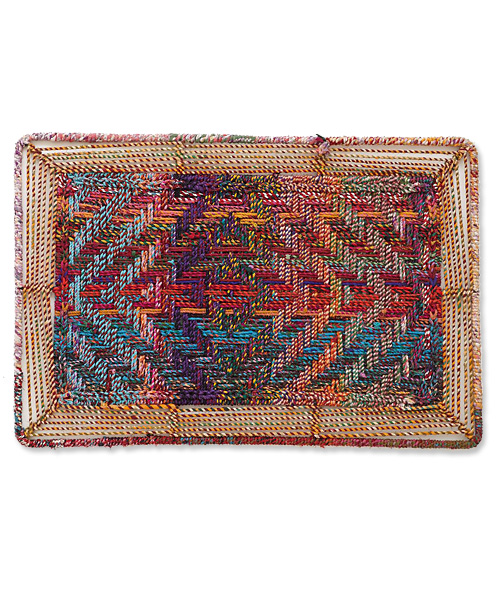
Identify the location of rug edges. The height and width of the screenshot is (600, 500). coord(465,139), coord(25,138), coord(22,439), coord(476,435).